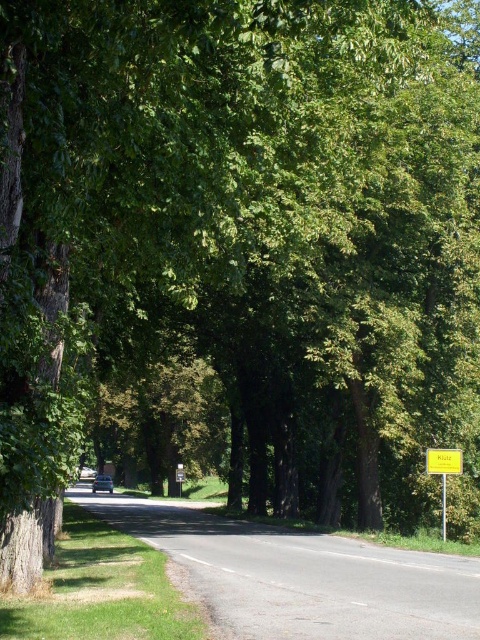
Question: Can you confirm if yellow plastic sign at right is bigger than metallic silver car at center?

Choices:
 (A) yes
 (B) no

Answer: (B)

Question: Which is farther from the metallic silver car at center?

Choices:
 (A) yellow plastic sign at center right
 (B) yellow plastic sign at right

Answer: (A)

Question: Can you confirm if yellow plastic sign at center right is smaller than yellow plastic sign at right?

Choices:
 (A) yes
 (B) no

Answer: (B)

Question: Which object is positioned closest to the metallic silver car at center?

Choices:
 (A) yellow plastic sign at center right
 (B) yellow plastic sign at right

Answer: (B)

Question: Which is nearer to the yellow plastic sign at right?

Choices:
 (A) metallic silver car at center
 (B) yellow plastic sign at center right

Answer: (B)

Question: From the image, what is the correct spatial relationship of yellow plastic sign at right in relation to metallic silver car at center?

Choices:
 (A) right
 (B) left

Answer: (A)